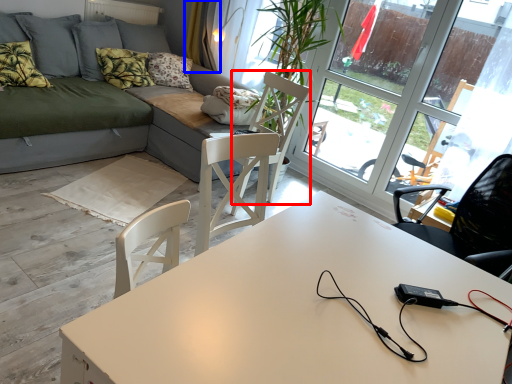
Question: Which point is closer to the camera, swivel chair (highlighted by a red box) or curtain (highlighted by a blue box)?

Choices:
 (A) swivel chair
 (B) curtain

Answer: (A)